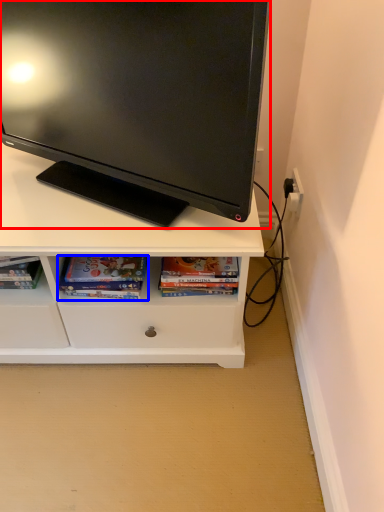
Question: Which point is closer to the camera, television (highlighted by a red box) or book (highlighted by a blue box)?

Choices:
 (A) television
 (B) book

Answer: (A)